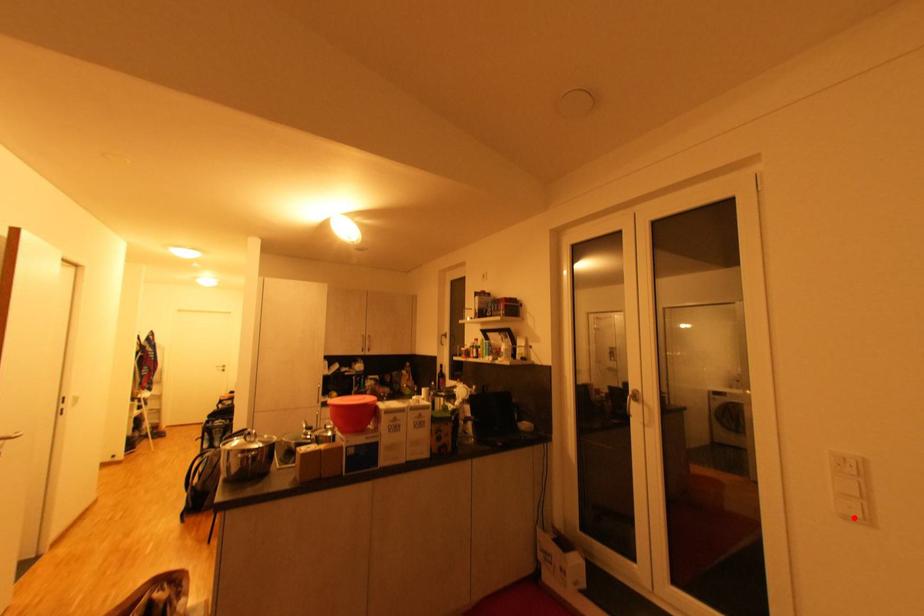
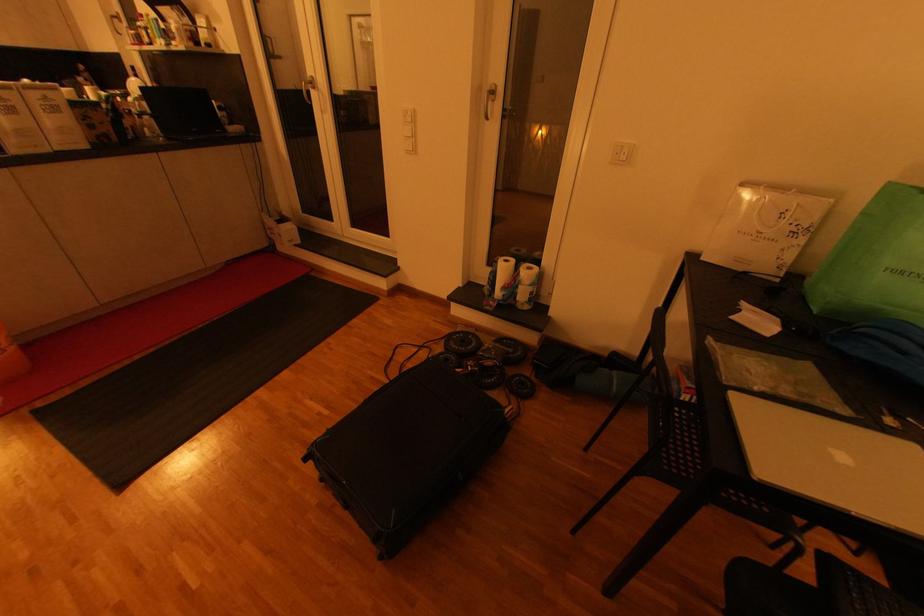
The point at the highlighted location is marked in the first image. Where is the corresponding point in the second image?

(412, 153)